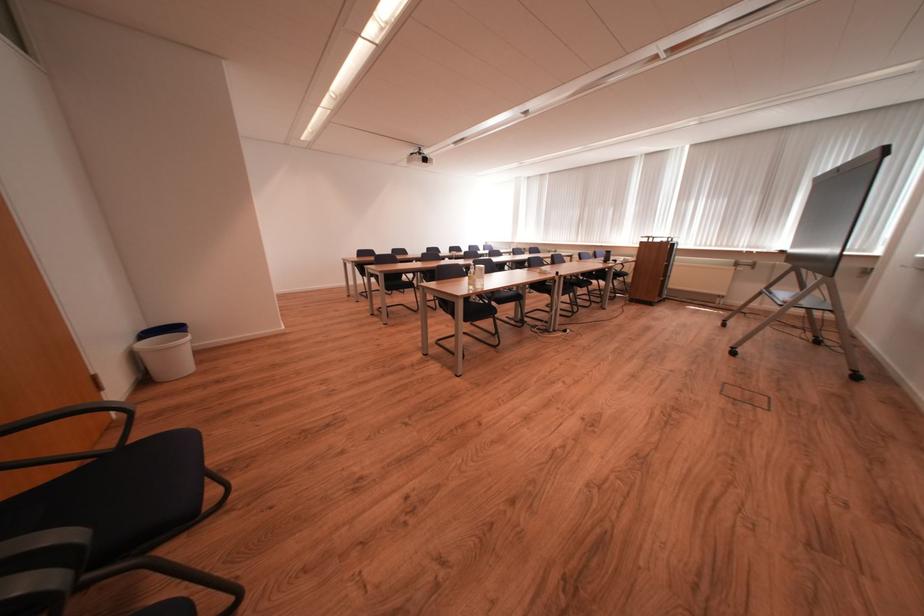
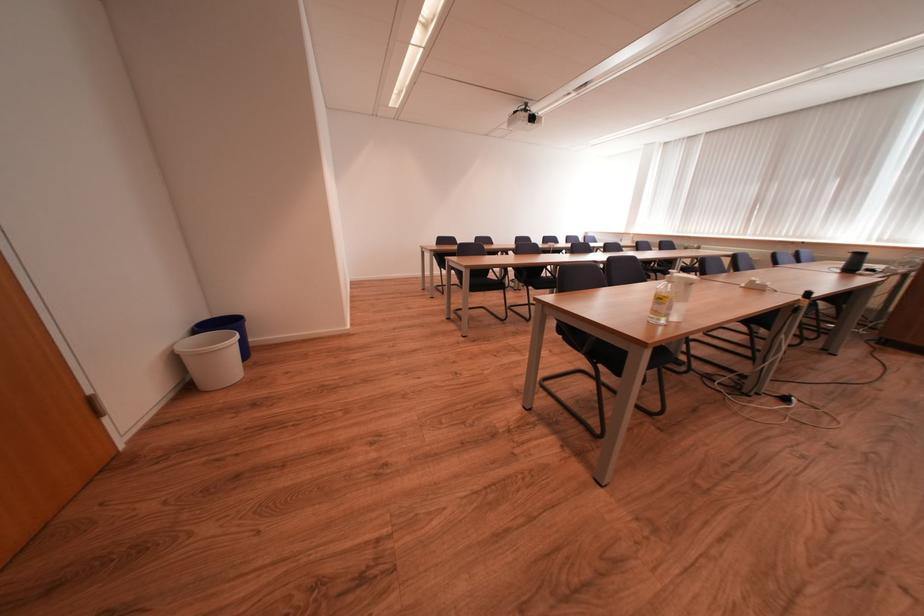
What movement of the cameraman would produce the second image?

The cameraman moved toward left, forward.